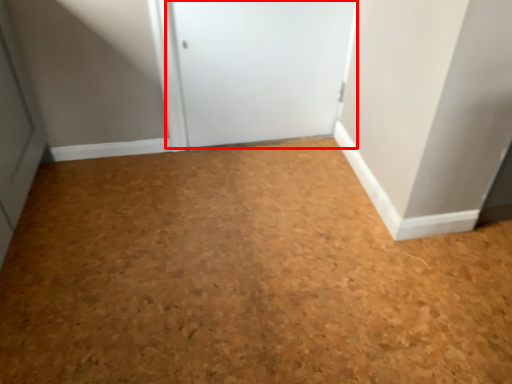
Question: Where is door (annotated by the red box) located in relation to plain in the image?

Choices:
 (A) right
 (B) left

Answer: (B)